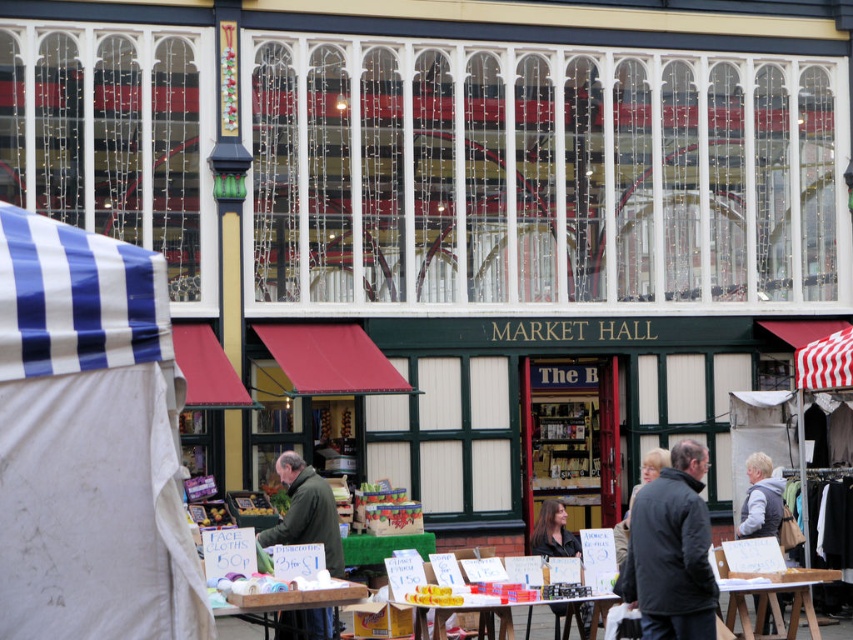
Question: Which is nearer to the black matte jacket at center?

Choices:
 (A) wooden table at lower center
 (B) dark brown hair at center
 (C) wooden table at center

Answer: (A)

Question: Which point is farther to the camera?

Choices:
 (A) (741, 596)
 (B) (685, 541)
 (C) (346, 580)
 (D) (544, 518)

Answer: (C)

Question: Can you confirm if green matte jacket at center is positioned above translucent plastic table at center?

Choices:
 (A) yes
 (B) no

Answer: (A)

Question: Which point is farther to the camera?

Choices:
 (A) wooden table at lower center
 (B) green matte jacket at center
 (C) wooden table at center

Answer: (B)

Question: Is wooden table at center below translucent plastic table at center?

Choices:
 (A) no
 (B) yes

Answer: (B)

Question: Can you confirm if black matte jacket at center is smaller than green matte jacket at center?

Choices:
 (A) yes
 (B) no

Answer: (B)